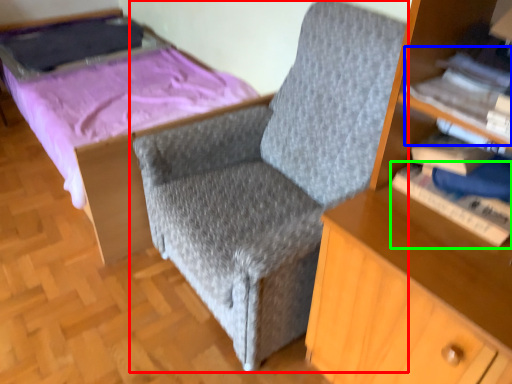
Question: Which object is positioned closest to chair (highlighted by a red box)? Select from book (highlighted by a blue box) and book (highlighted by a green box).

Choices:
 (A) book
 (B) book

Answer: (B)